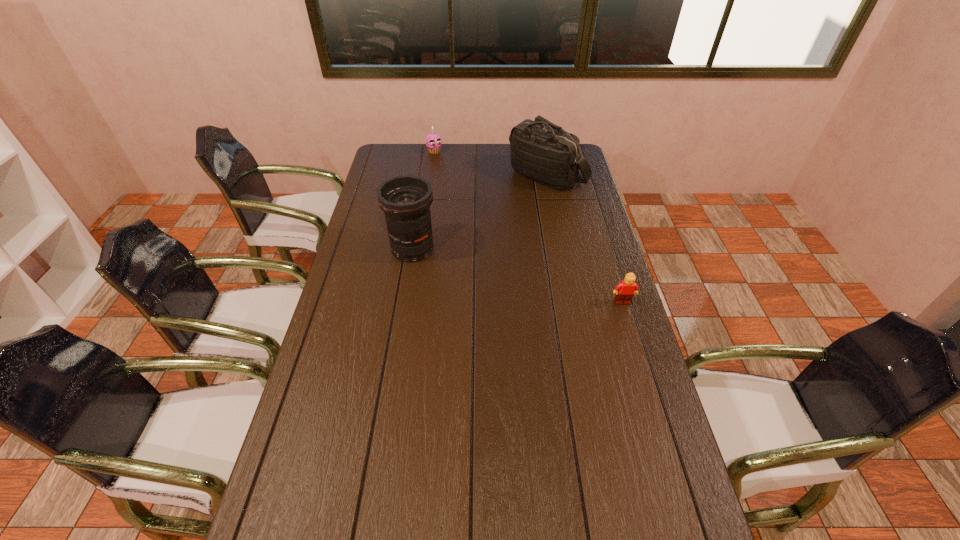
The height and width of the screenshot is (540, 960). I want to click on free spot on the desktop that is between the telephoto lens and the nearest object and is positioned at the front padded panel of the third nearest object, so click(489, 268).

Locate an element on the screen. The width and height of the screenshot is (960, 540). vacant spot on the desktop that is between the second nearest object and the Lego and is positioned on the face of the cupcake is located at coordinates (518, 276).